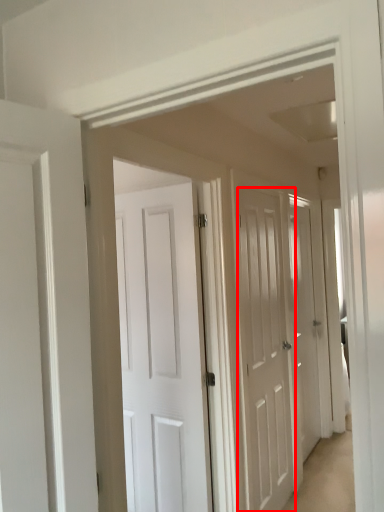
Question: From the image's perspective, what is the correct spatial positioning of door (annotated by the red box) in reference to door?

Choices:
 (A) below
 (B) above

Answer: (A)